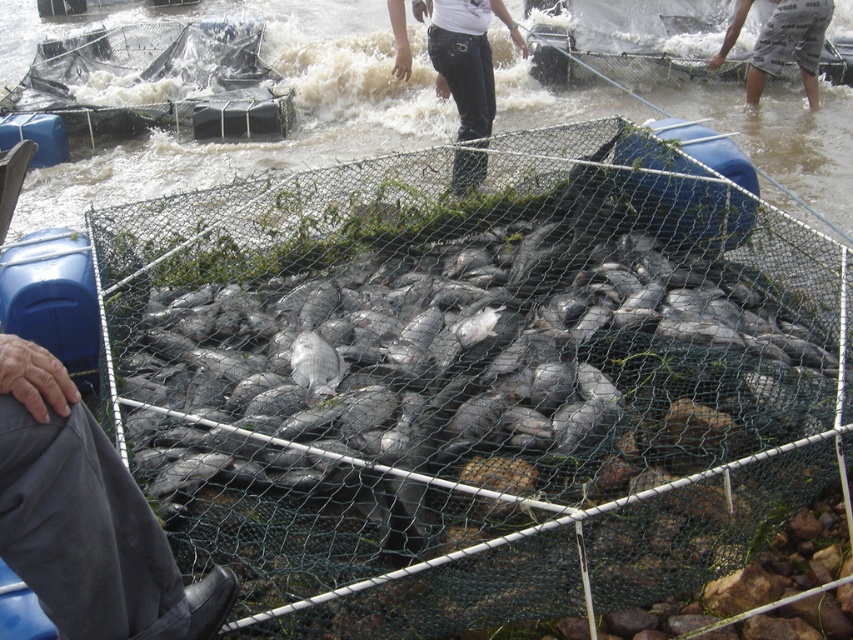
You are a fish farmer checking the enclosure. You notice the silvery metallic fish at center and the gray cotton shorts at upper right. Which object is positioned more to the right side of the enclosure?

The gray cotton shorts at upper right is positioned more to the right side of the enclosure than the silvery metallic fish at center.

You are a fish farmer checking the enclosure. You notice the silvery metallic fish at center and the black denim pants at upper center. Which object is positioned higher in the image?

The black denim pants at upper center is positioned higher in the image than the silvery metallic fish at center.